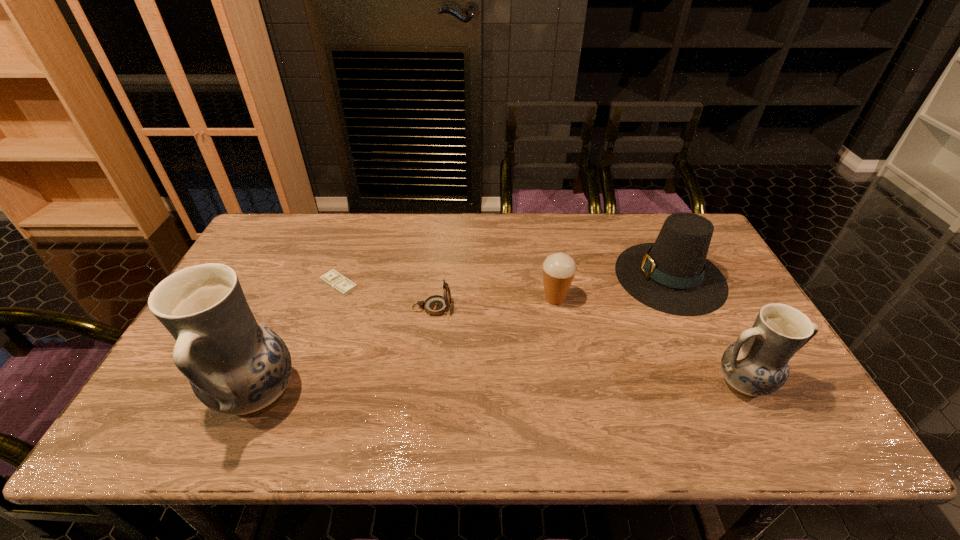
Where is `unoccupied position between the taller pottery and the icecream`? unoccupied position between the taller pottery and the icecream is located at coordinates (406, 346).

Locate an element on the screen. The width and height of the screenshot is (960, 540). vacant space that's between the shorter pottery and the compass is located at coordinates (588, 346).

Where is `free point between the fourth object from left to right and the compass`? This screenshot has width=960, height=540. free point between the fourth object from left to right and the compass is located at coordinates (493, 303).

You are a GUI agent. You are given a task and a screenshot of the screen. Output one action in this format:
    pyautogui.click(x=<x>, y=<y>)
    Task: Click on the vacant region between the fourth object from right to left and the third object from right to left
    This screenshot has width=960, height=540.
    Given the screenshot: What is the action you would take?
    tap(493, 303)

Locate an element on the screen. The height and width of the screenshot is (540, 960). free space between the right pottery and the shortest object is located at coordinates (541, 334).

Where is `vacant point located between the left pottery and the fifth tallest object`? Image resolution: width=960 pixels, height=540 pixels. vacant point located between the left pottery and the fifth tallest object is located at coordinates (345, 351).

Where is `empty location between the taller pottery and the fourth tallest object`? The image size is (960, 540). empty location between the taller pottery and the fourth tallest object is located at coordinates [x=406, y=346].

The height and width of the screenshot is (540, 960). Identify the location of free space that is in between the money and the hat. (505, 280).

The height and width of the screenshot is (540, 960). Identify the location of object that ranks as the fifth closest to the hat. (236, 366).

You are a GUI agent. You are given a task and a screenshot of the screen. Output one action in this format:
    pyautogui.click(x=<x>, y=<y>)
    Task: Click on the object that is the fifth closest to the compass
    This screenshot has height=540, width=960.
    Given the screenshot: What is the action you would take?
    pyautogui.click(x=757, y=364)